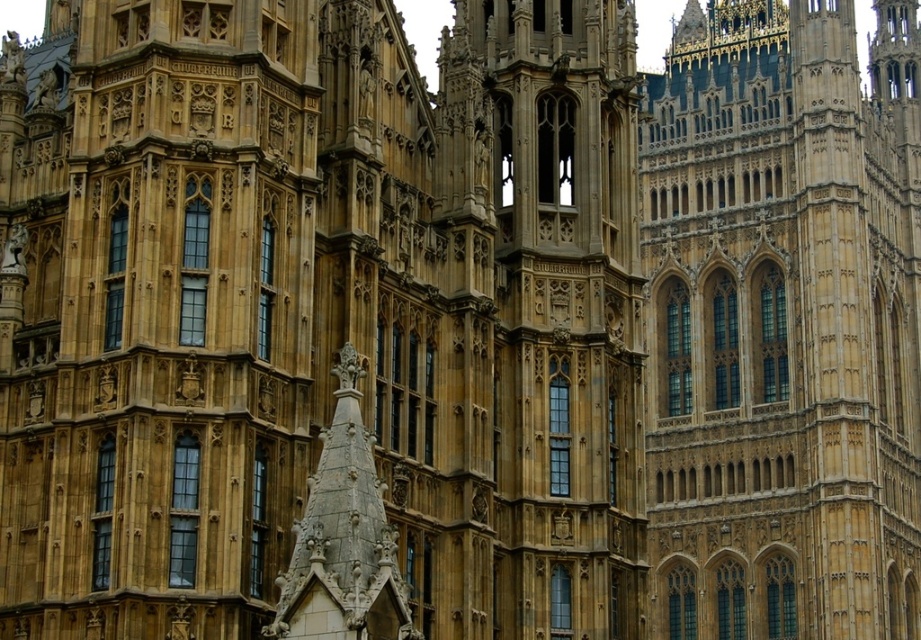
Question: Which point appears closest to the camera in this image?

Choices:
 (A) (561, 310)
 (B) (661, 554)

Answer: (A)

Question: Considering the relative positions of golden stone tower at upper right and golden stone tower at center in the image provided, where is golden stone tower at upper right located with respect to golden stone tower at center?

Choices:
 (A) right
 (B) left

Answer: (A)

Question: Is golden stone tower at upper right positioned before golden stone tower at center?

Choices:
 (A) no
 (B) yes

Answer: (A)

Question: Is golden stone tower at upper right positioned in front of golden stone tower at center?

Choices:
 (A) no
 (B) yes

Answer: (A)

Question: Which object is closer to the camera taking this photo?

Choices:
 (A) golden stone tower at center
 (B) golden stone tower at upper right

Answer: (A)